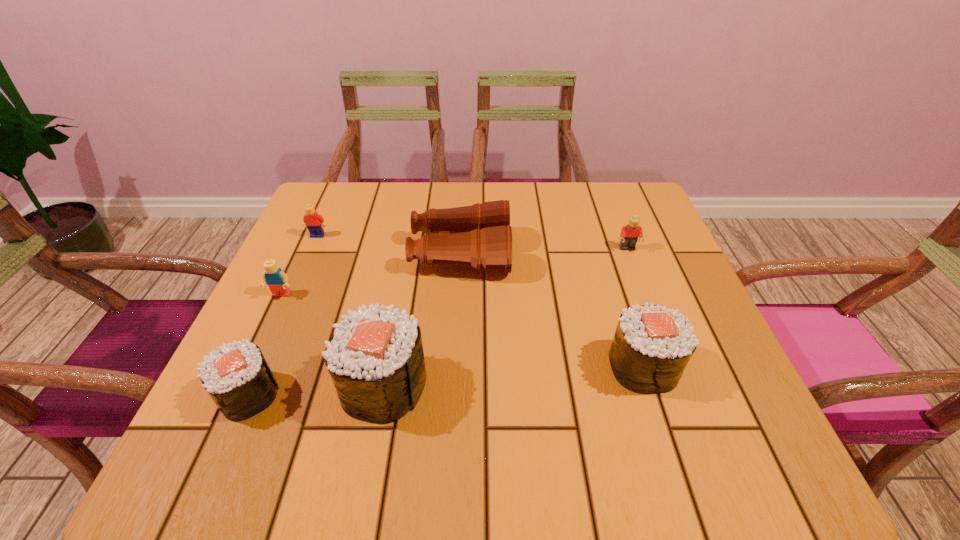
The image size is (960, 540). I want to click on the second closest Lego to the rightmost Lego, so click(274, 277).

I want to click on Lego that is the second closest to the fourth nearest object, so click(x=629, y=235).

This screenshot has height=540, width=960. What are the coordinates of `free spot that satisfies the following two spatial constraints: 1. on the front-facing side of the leftmost sushi; 2. on the right side of the fourth nearest object` in the screenshot? It's located at (235, 395).

Locate an element on the screen. The image size is (960, 540). free spot that satisfies the following two spatial constraints: 1. on the back side of the rightmost sushi; 2. through the lenses of the binoculars is located at coordinates (606, 254).

Locate an element on the screen. free region that satisfies the following two spatial constraints: 1. on the face of the farthest Lego; 2. on the left side of the rightmost sushi is located at coordinates (260, 367).

Where is `free location that satisfies the following two spatial constraints: 1. through the lenses of the second shortest sushi; 2. on the left side of the binoculars`? This screenshot has width=960, height=540. free location that satisfies the following two spatial constraints: 1. through the lenses of the second shortest sushi; 2. on the left side of the binoculars is located at coordinates (455, 367).

The height and width of the screenshot is (540, 960). What are the coordinates of `free location that satisfies the following two spatial constraints: 1. on the face of the leftmost sushi; 2. on the left side of the farthest Lego` in the screenshot? It's located at (248, 395).

Locate an element on the screen. The image size is (960, 540). vacant area in the image that satisfies the following two spatial constraints: 1. on the front-facing side of the leftmost sushi; 2. on the right side of the nearest Lego is located at coordinates (235, 395).

Identify the location of free location that satisfies the following two spatial constraints: 1. on the back side of the second shortest sushi; 2. through the lenses of the binoculars. (606, 254).

Locate an element on the screen. free space that satisfies the following two spatial constraints: 1. on the back side of the tallest object; 2. on the left side of the leftmost sushi is located at coordinates (252, 385).